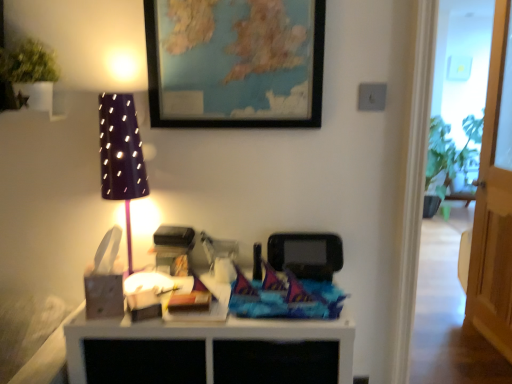
Question: From a real-world perspective, does green matte plant at upper left stand above transparent wooden door at right?

Choices:
 (A) yes
 (B) no

Answer: (A)

Question: Does green matte plant at upper left have a lesser height compared to transparent wooden door at right?

Choices:
 (A) no
 (B) yes

Answer: (B)

Question: Is there a large distance between green matte plant at upper left and transparent wooden door at right?

Choices:
 (A) no
 (B) yes

Answer: (B)

Question: From a real-world perspective, does green matte plant at upper left sit lower than transparent wooden door at right?

Choices:
 (A) yes
 (B) no

Answer: (B)

Question: Is green matte plant at upper left closer to the viewer compared to transparent wooden door at right?

Choices:
 (A) no
 (B) yes

Answer: (B)

Question: From the image's perspective, is matte black lampshade at left positioned above or below transparent wooden door at right?

Choices:
 (A) below
 (B) above

Answer: (A)

Question: In terms of size, does matte black lampshade at left appear bigger or smaller than transparent wooden door at right?

Choices:
 (A) small
 (B) big

Answer: (A)

Question: Is matte black lampshade at left to the left or to the right of transparent wooden door at right in the image?

Choices:
 (A) right
 (B) left

Answer: (B)

Question: From a real-world perspective, relative to transparent wooden door at right, is matte black lampshade at left vertically above or below?

Choices:
 (A) below
 (B) above

Answer: (B)

Question: Relative to matte black lampshade at left, is matte black picture frame at upper center in front or behind?

Choices:
 (A) front
 (B) behind

Answer: (B)

Question: Would you say matte black picture frame at upper center is inside or outside matte black lampshade at left?

Choices:
 (A) outside
 (B) inside

Answer: (A)

Question: Based on their positions, is matte black picture frame at upper center located to the left or right of matte black lampshade at left?

Choices:
 (A) right
 (B) left

Answer: (A)

Question: Does point (322, 79) appear closer or farther from the camera than point (143, 178)?

Choices:
 (A) closer
 (B) farther

Answer: (B)

Question: Looking at the image, does transparent wooden door at right seem bigger or smaller compared to wooden table at center?

Choices:
 (A) small
 (B) big

Answer: (A)

Question: Would you say transparent wooden door at right is to the left or to the right of wooden table at center in the picture?

Choices:
 (A) left
 (B) right

Answer: (B)